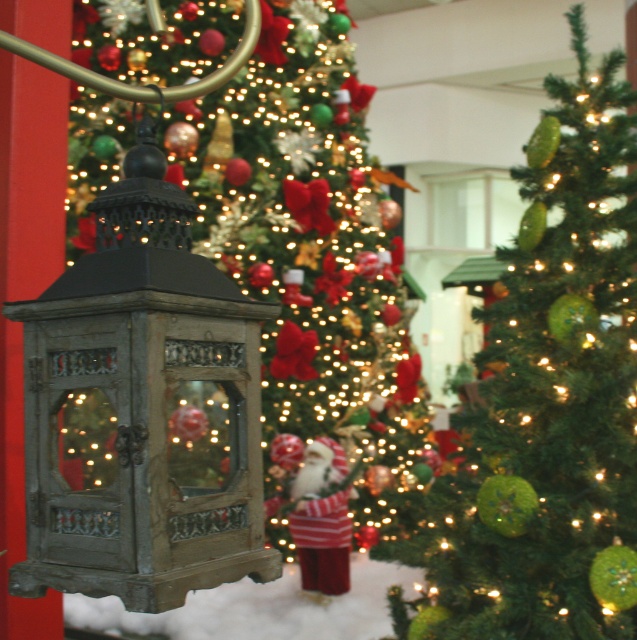
Question: Is green textured christmas tree at center further to camera compared to green textured ornaments at center?

Choices:
 (A) yes
 (B) no

Answer: (A)

Question: Does green textured christmas tree at center have a larger size compared to green textured ornaments at center?

Choices:
 (A) yes
 (B) no

Answer: (A)

Question: Which of the following is the farthest from the observer?

Choices:
 (A) (541, 148)
 (B) (262, 128)

Answer: (B)

Question: Which point is closer to the camera?

Choices:
 (A) (352, 412)
 (B) (519, 563)

Answer: (B)

Question: Considering the relative positions of green textured christmas tree at center and green textured ornaments at center in the image provided, where is green textured christmas tree at center located with respect to green textured ornaments at center?

Choices:
 (A) below
 (B) above

Answer: (B)